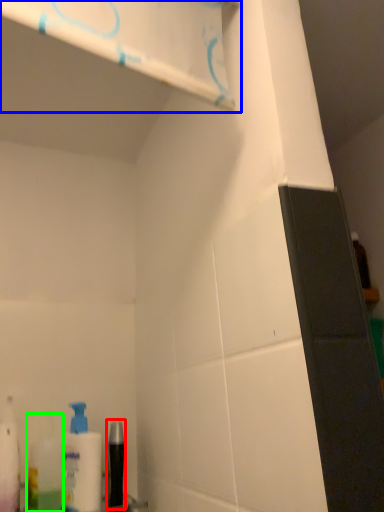
Question: Considering the real-world distances, which object is farthest from mouthwash (highlighted by a red box)? shelf (highlighted by a blue box) or mouthwash (highlighted by a green box)?

Choices:
 (A) shelf
 (B) mouthwash

Answer: (A)